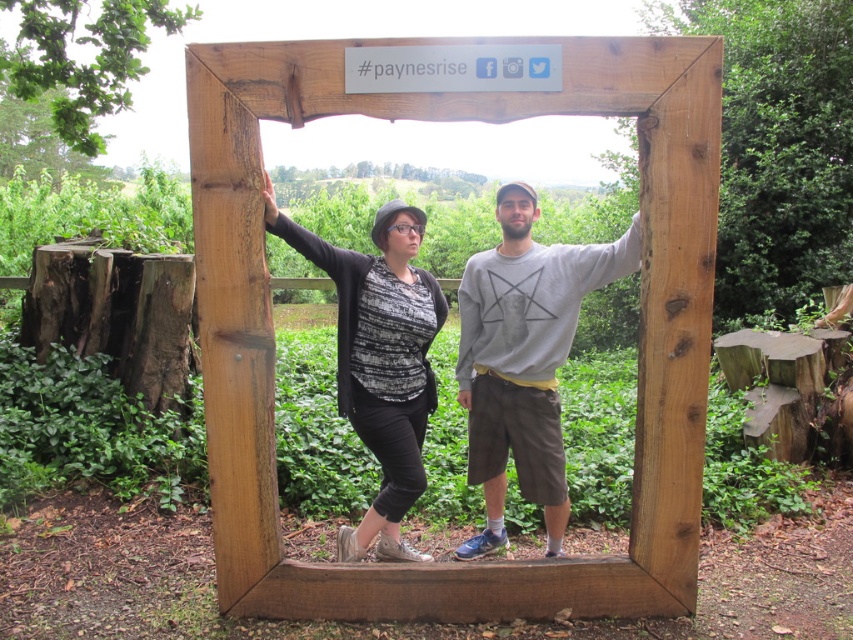
You are an event organizer at the wooden frame structure with the hashtag sign. You need to choose between the matte gray sweater at center and the gray cotton sweatshirt at center for a promotional photo. Which one should you pick if you want the clothing item to stand out more in the photo?

The matte gray sweater at center has a larger size compared to the gray cotton sweatshirt at center, so it would stand out more in the photo due to its bigger size.

You are a photographer planning to take a group photo of the two people in the image. The matte gray sweater at center and the matte black cardigan at left are positioned within a narrow wooden frame. To ensure both can fit side by side without overlapping, which person should move closer to the center?

The matte black cardigan at left should move closer to the center because the matte gray sweater at center is wider, requiring more space. This adjustment would help both fit within the frame without overlapping.

You are a photographer who wants to capture both the matte gray sweater at center and the matte black cardigan at left in the same frame. Based on their positions, which one should you focus on first to ensure both are in the shot?

Since the matte gray sweater at center is to the right of the matte black cardigan at left, you should focus on the matte black cardigan at left first to ensure both are included in the frame.